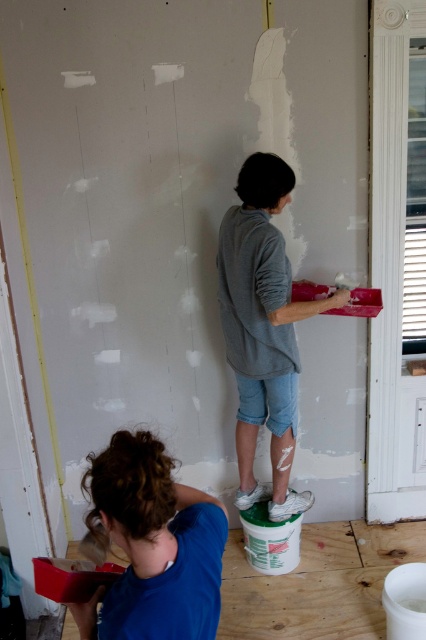
Question: Which object is farther from the camera taking this photo?

Choices:
 (A) blue fabric shirt at lower left
 (B) gray cotton shirt at center

Answer: (B)

Question: Does blue fabric shirt at lower left appear on the left side of gray cotton shirt at center?

Choices:
 (A) no
 (B) yes

Answer: (B)

Question: Is blue fabric shirt at lower left positioned before gray cotton shirt at center?

Choices:
 (A) yes
 (B) no

Answer: (A)

Question: Can you confirm if blue fabric shirt at lower left is thinner than gray cotton shirt at center?

Choices:
 (A) yes
 (B) no

Answer: (A)

Question: Which object appears farthest from the camera in this image?

Choices:
 (A) blue fabric shirt at lower left
 (B) gray cotton shirt at center

Answer: (B)